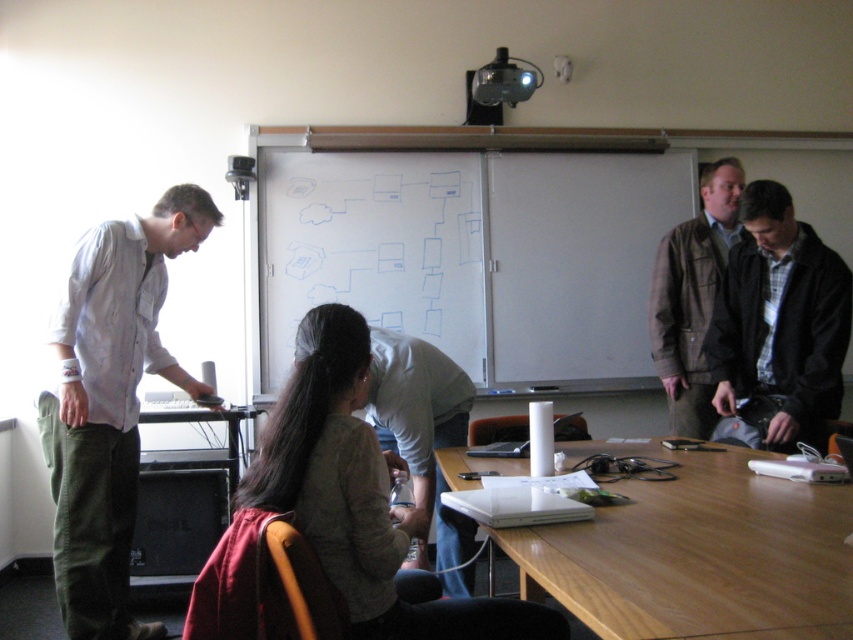
You are standing at the back of the classroom near the whiteboard and want to walk to the point labeled point (376, 570). However, there is an obstacle at point (770, 301). Will you be able to reach your destination without going around the obstacle?

Since point (376, 570) is in front of point (770, 301), you can reach point (376, 570) without going around the obstacle at point (770, 301) because it is closer to you.

You are organizing a coat rack for the classroom and need to place the light brown fabric jacket at center and the dark brown leather jacket at right. According to their positions in the image, which jacket should be placed to the left of the other on the coat rack?

The light brown fabric jacket at center should be placed to the left of the dark brown leather jacket at right because in the image, the light brown fabric jacket at center is positioned on the left side of dark brown leather jacket at right.